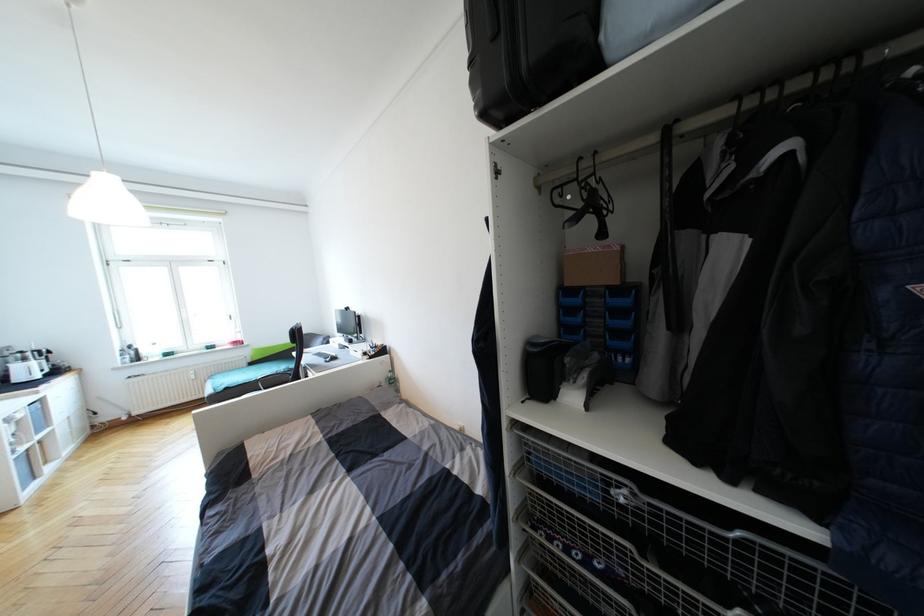
Locate an element on the screen. This screenshot has height=616, width=924. window handle is located at coordinates (116, 310).